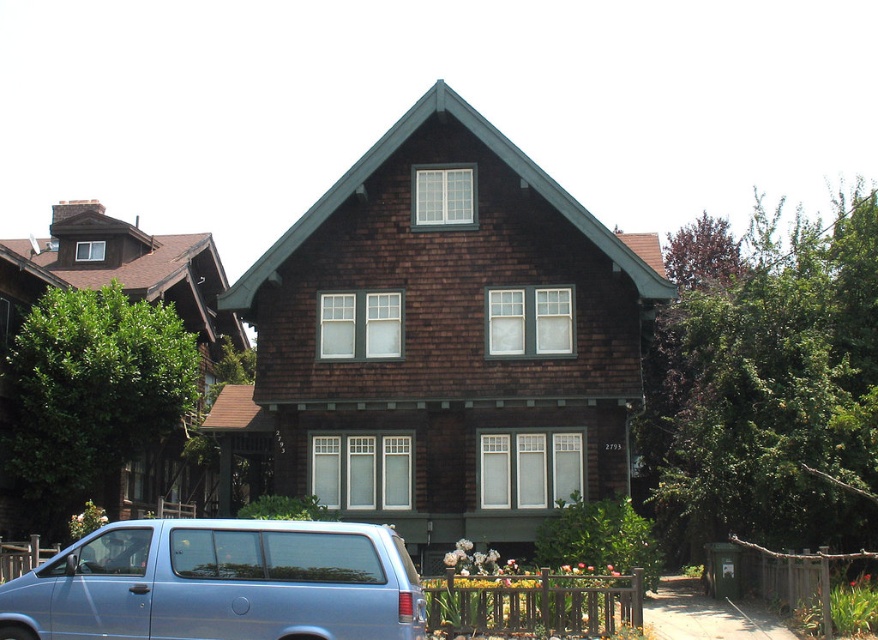
Where is `brown shingles at center`? brown shingles at center is located at coordinates (450, 337).

Is brown shingles at center positioned before metallic blue van at lower left?

No, brown shingles at center is behind metallic blue van at lower left.

Is point (335, 419) positioned after point (52, 625)?

Yes.

Where is `brown shingles at center`? This screenshot has height=640, width=878. brown shingles at center is located at coordinates (450, 337).